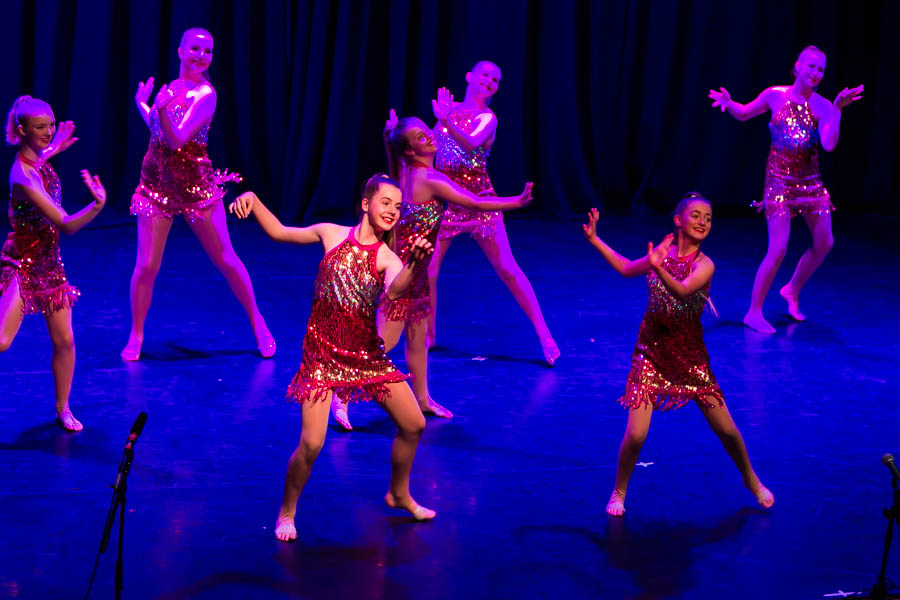
Locate an element on the screen. The width and height of the screenshot is (900, 600). floor is located at coordinates (536, 435).